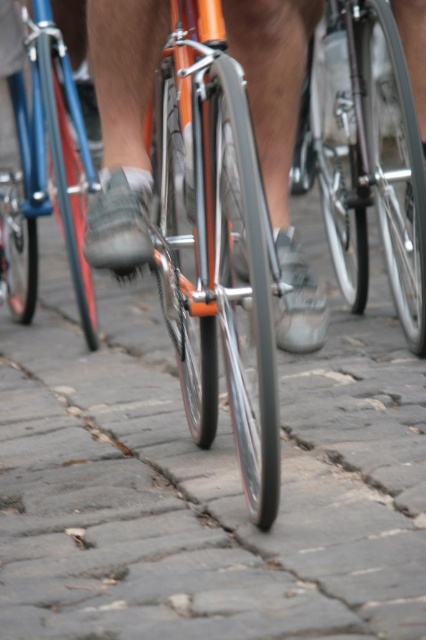
Question: Among these objects, which one is nearest to the camera?

Choices:
 (A) shiny blue frame at center
 (B) shiny orange frame at center

Answer: (B)

Question: Which of the following is the farthest from the observer?

Choices:
 (A) shiny blue frame at center
 (B) shiny orange frame at center
 (C) shiny silver bicycle at center

Answer: (A)

Question: Does shiny silver bicycle at center appear under shiny blue frame at center?

Choices:
 (A) yes
 (B) no

Answer: (B)

Question: Can you confirm if shiny silver bicycle at center is bigger than shiny blue frame at center?

Choices:
 (A) yes
 (B) no

Answer: (A)

Question: Which object is positioned closest to the shiny silver bicycle at center?

Choices:
 (A) shiny orange frame at center
 (B) shiny blue frame at center

Answer: (A)

Question: Does shiny orange frame at center come behind shiny silver bicycle at center?

Choices:
 (A) yes
 (B) no

Answer: (B)